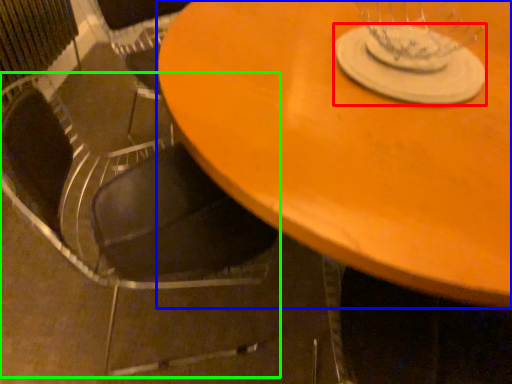
Question: Considering the real-world distances, which object is farthest from glass plate (highlighted by a red box)? table (highlighted by a blue box) or chair (highlighted by a green box)?

Choices:
 (A) table
 (B) chair

Answer: (B)